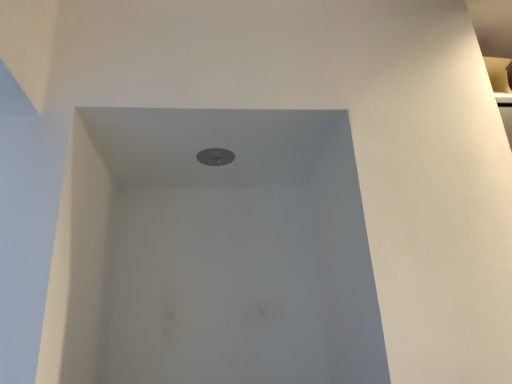
The height and width of the screenshot is (384, 512). What do you see at coordinates (215, 157) in the screenshot?
I see `matte black shower at center` at bounding box center [215, 157].

This screenshot has height=384, width=512. Find the location of `matte black shower at center`. matte black shower at center is located at coordinates (215, 157).

The height and width of the screenshot is (384, 512). I want to click on matte black shower at center, so click(x=215, y=157).